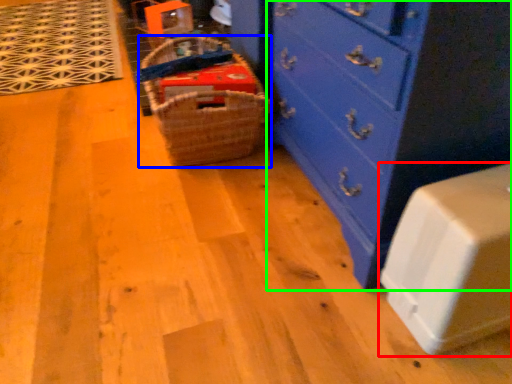
Question: Which object is positioned farthest from cabinetry (highlighted by a red box)? Select from basket (highlighted by a blue box) and chest of drawers (highlighted by a green box).

Choices:
 (A) basket
 (B) chest of drawers

Answer: (A)